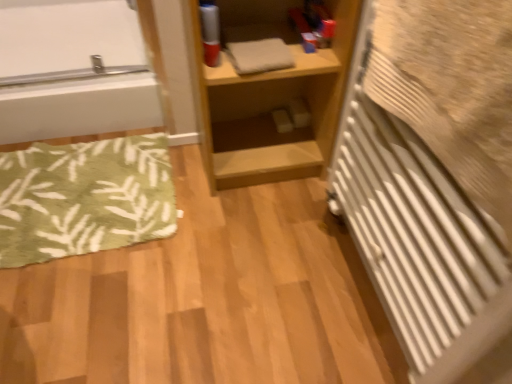
You are a GUI agent. You are given a task and a screenshot of the screen. Output one action in this format:
    pyautogui.click(x=<x>, y=<y>)
    Task: Click on the free location in front of light wood shelf at center
    The height and width of the screenshot is (384, 512).
    Given the screenshot: What is the action you would take?
    pyautogui.click(x=253, y=224)